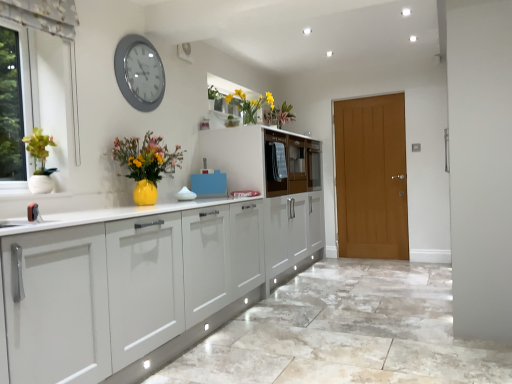
Where is `unoccupied area in front of matte wood door at right`? unoccupied area in front of matte wood door at right is located at coordinates (378, 267).